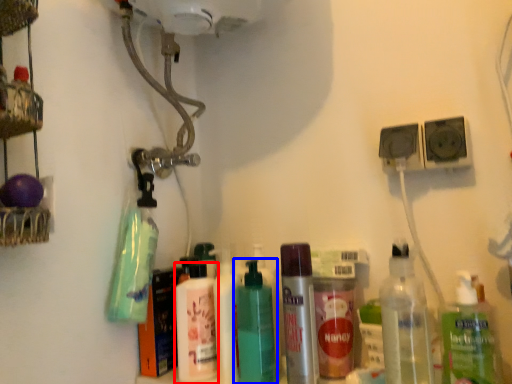
Question: Among these objects, which one is nearest to the camera, bottle (highlighted by a red box) or bottle (highlighted by a blue box)?

Choices:
 (A) bottle
 (B) bottle

Answer: (B)